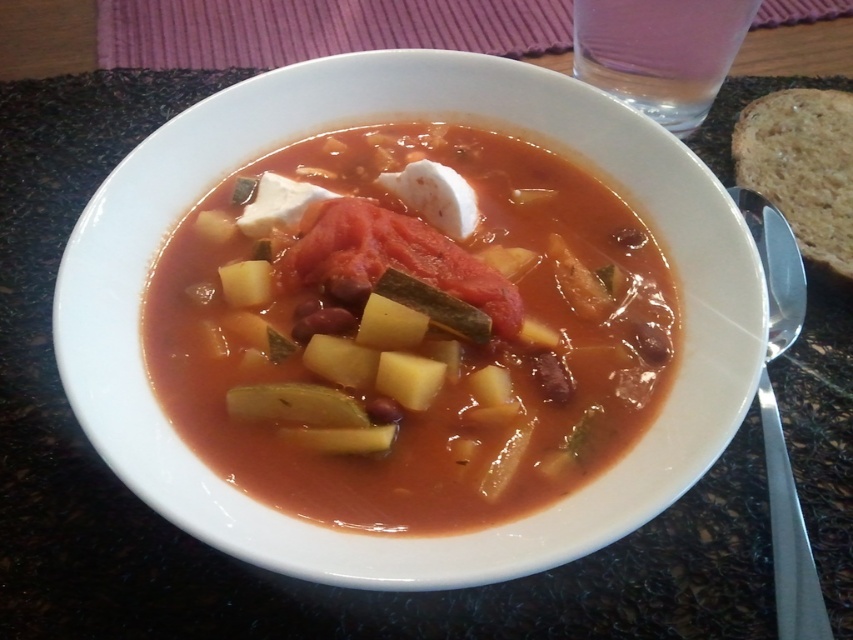
Where is `brown crusty bread at right`? brown crusty bread at right is located at coordinates (802, 166).

Is brown crusty bread at right wider than satin silver spoon at right?

Yes.

Which is in front, point (735, 179) or point (776, 484)?

Point (776, 484) is in front.

Identify the location of brown crusty bread at right. (802, 166).

Is tomato-yet-soft soup at center behind satin silver spoon at right?

No, tomato-yet-soft soup at center is in front of satin silver spoon at right.

What do you see at coordinates (410, 332) in the screenshot? This screenshot has height=640, width=853. I see `tomato-yet-soft soup at center` at bounding box center [410, 332].

Find the location of a particular element. The width and height of the screenshot is (853, 640). tomato-yet-soft soup at center is located at coordinates (410, 332).

Consider the image. Who is positioned more to the right, tomato-yet-soft soup at center or brown crusty bread at right?

brown crusty bread at right is more to the right.

Between point (627, 236) and point (770, 120), which one is positioned behind?

Point (770, 120)

Is point (606, 260) more distant than point (744, 124)?

That is False.

This screenshot has height=640, width=853. Find the location of `tomato-yet-soft soup at center`. tomato-yet-soft soup at center is located at coordinates (410, 332).